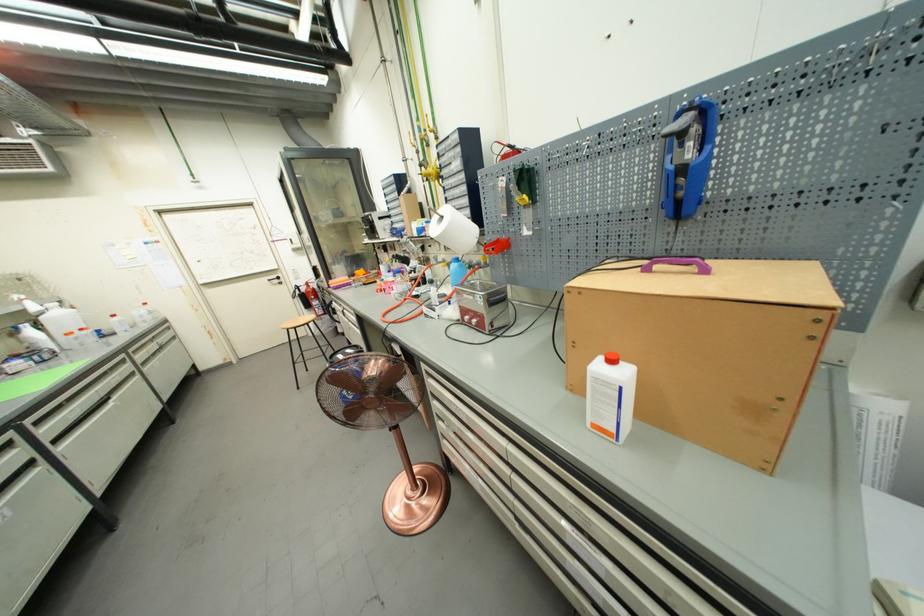
This screenshot has width=924, height=616. In order to click on orange bottle cap in this screenshot , I will do `click(611, 358)`.